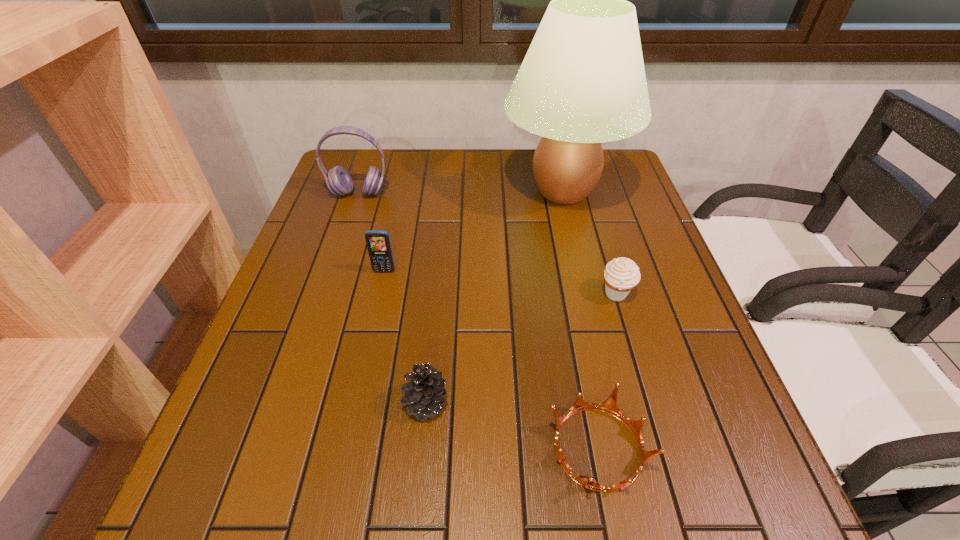
Where is `lampshade`? The width and height of the screenshot is (960, 540). lampshade is located at coordinates [582, 82].

Find the location of a particular element. This screenshot has height=540, width=960. the second tallest object is located at coordinates (338, 180).

In order to click on the leftmost object in this screenshot , I will do `click(338, 180)`.

At what (x,y) coordinates should I click in order to perform the action: click on the fourth nearest object. Please return your answer as a coordinate pair (x, y). The height and width of the screenshot is (540, 960). Looking at the image, I should click on (378, 243).

In order to click on the second object from left to right in this screenshot , I will do `click(378, 243)`.

You are a GUI agent. You are given a task and a screenshot of the screen. Output one action in this format:
    pyautogui.click(x=<x>, y=<y>)
    Task: Click on the fourth object from right to left
    The height and width of the screenshot is (540, 960).
    Given the screenshot: What is the action you would take?
    pyautogui.click(x=425, y=391)

Find the location of a particular element. the third nearest object is located at coordinates (621, 276).

This screenshot has width=960, height=540. Find the location of `crown`. crown is located at coordinates (609, 406).

Locate an element on the screen. This screenshot has height=540, width=960. free space located 0.190m on the shade of the lampshade is located at coordinates (435, 191).

The width and height of the screenshot is (960, 540). In order to click on vacant point located 0.110m on the shade of the lampshade in this screenshot , I will do `click(463, 191)`.